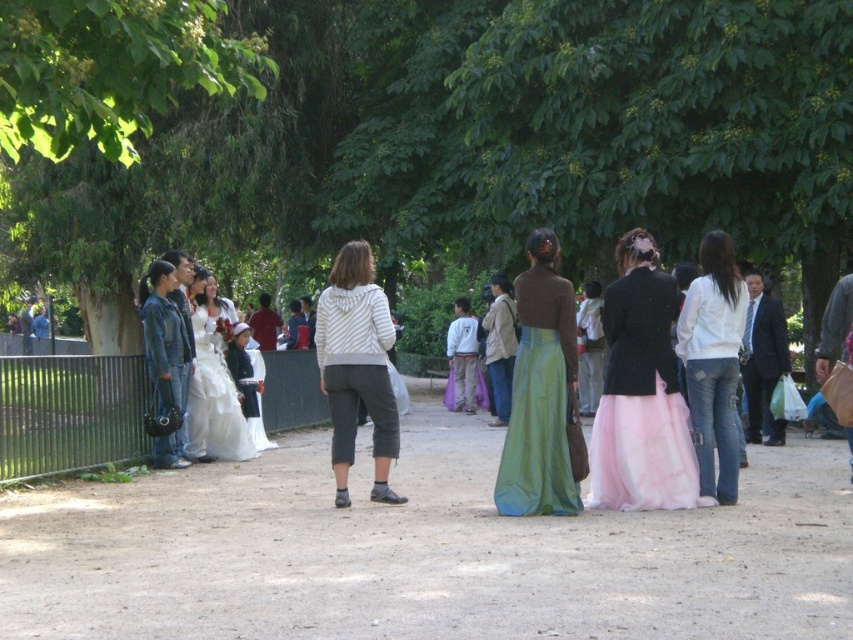
Question: Can you confirm if green metal fence at lower left is smaller than green satin dress at center?

Choices:
 (A) no
 (B) yes

Answer: (A)

Question: Which of the following is the farthest from the observer?

Choices:
 (A) green leafy tree at center
 (B) white satin dress at center
 (C) white striped sweater at center

Answer: (B)

Question: Is green leafy tree at center to the right of white satin dress at center from the viewer's perspective?

Choices:
 (A) no
 (B) yes

Answer: (B)

Question: Among these points, which one is farthest from the camera?

Choices:
 (A) (422, 253)
 (B) (213, 348)

Answer: (A)

Question: Among these objects, which one is farthest from the camera?

Choices:
 (A) white striped sweater at center
 (B) white satin dress at center
 (C) green metal fence at lower left
 (D) green leafy tree at center

Answer: (B)

Question: Where is white striped sweater at center located in relation to white satin dress at center in the image?

Choices:
 (A) left
 (B) right

Answer: (B)